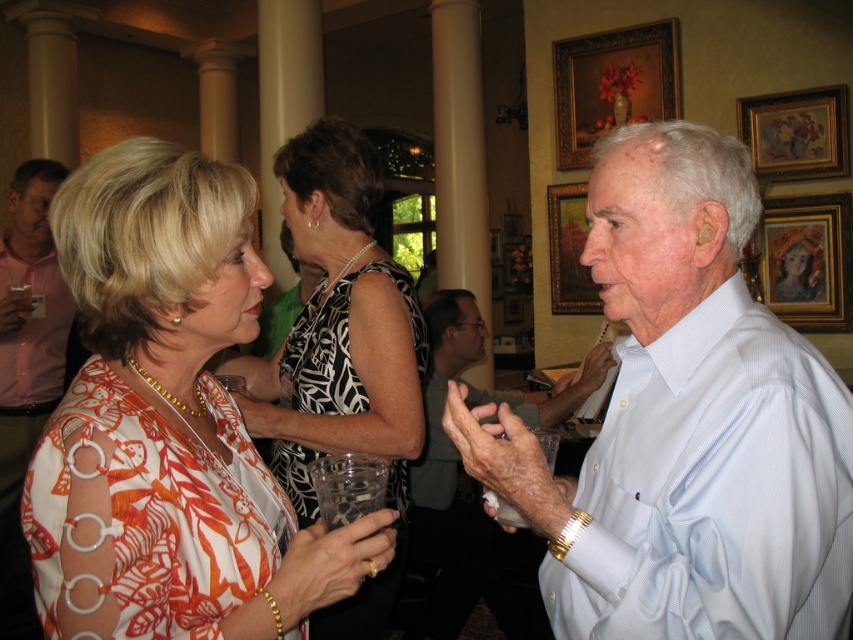
You are at the entrance of the room and want to locate the printed fabric blouse at left. Which direction should you move to find it?

The printed fabric blouse at left is located at point 0.662 on the x axis and 0.199 on the y axis. Since the x coordinate is 0.662, which is closer to the right side of the image, you should move to the right to find the printed fabric blouse at left.